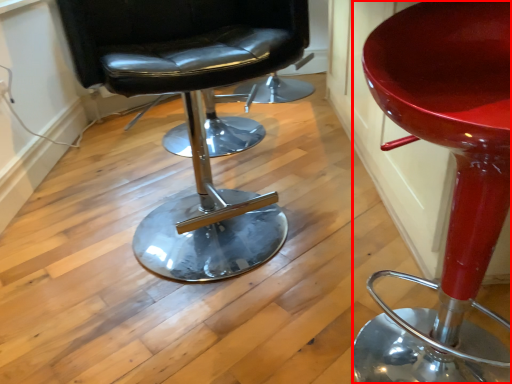
Question: From the image, what is the correct spatial relationship of chair (annotated by the red box) in relation to chair?

Choices:
 (A) right
 (B) left

Answer: (A)